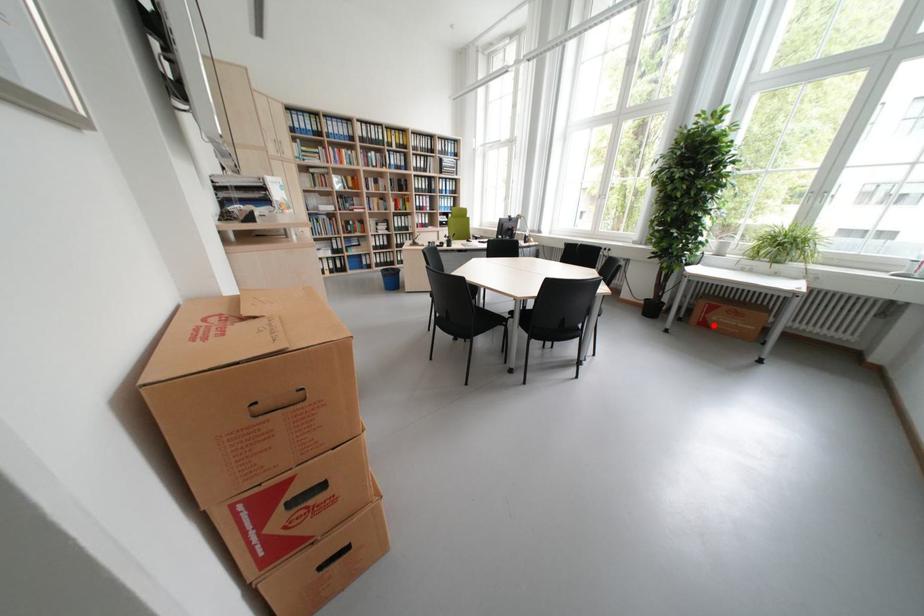
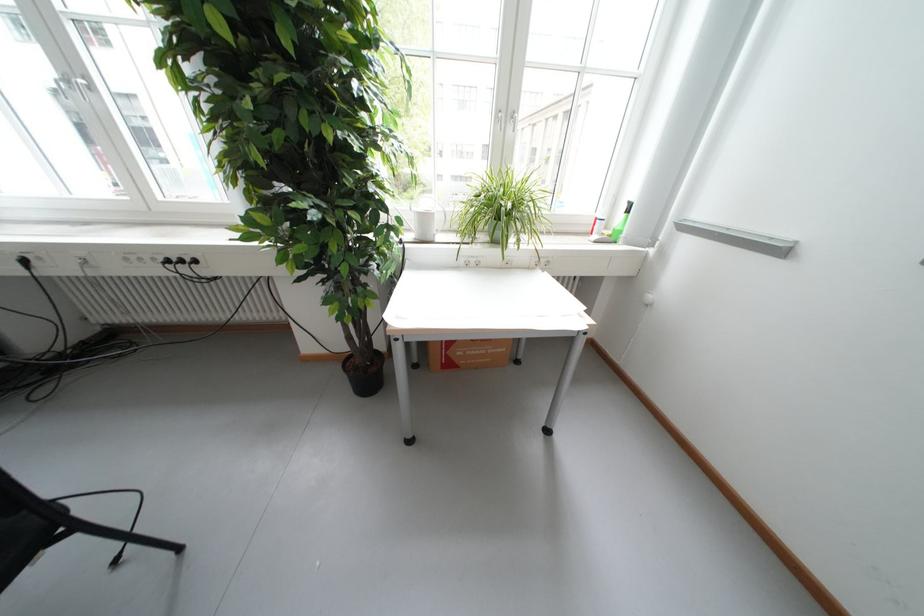
Question: A red point is marked in image1. In image2, is the corresponding 3D point closer to the camera or farther? Reply with the corresponding letter.

Choices:
 (A) The corresponding 3D point is closer.
 (B) The corresponding 3D point is farther.

Answer: (B)